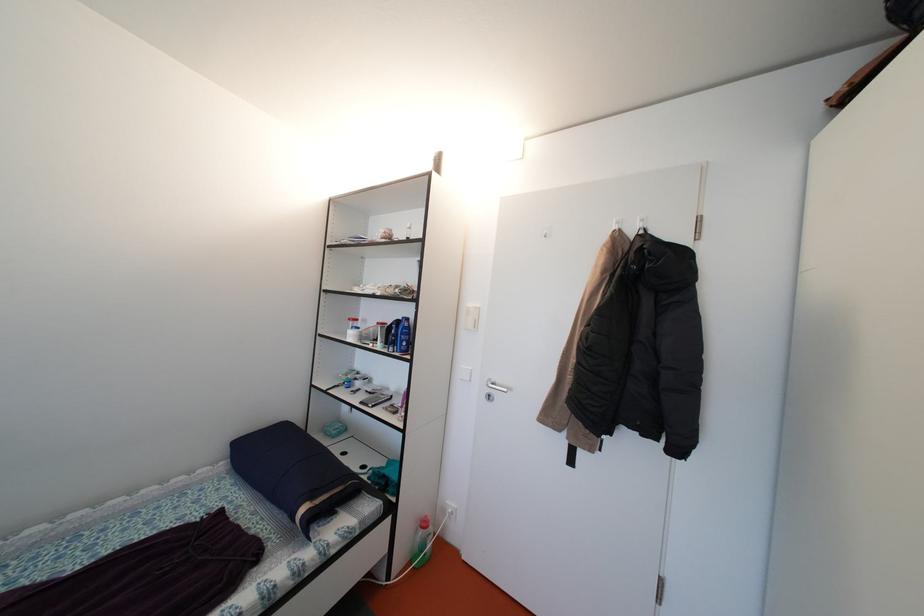
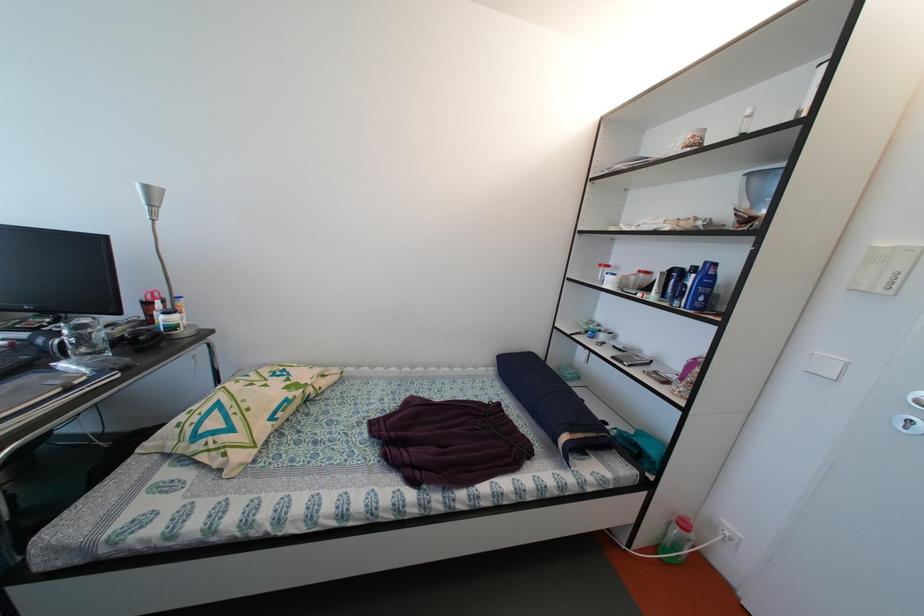
Question: The camera is either moving clockwise (left) or counter-clockwise (right) around the object. The first image is from the beginning of the video and the second image is from the end. Is the camera moving left or right when shooting the video?

Choices:
 (A) Left
 (B) Right

Answer: (B)